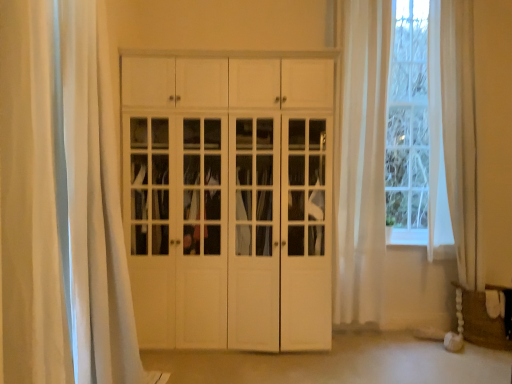
Question: Is sheer white curtain at right, the second curtain when ordered from left to right, wider or thinner than white matte cabinet at center?

Choices:
 (A) wide
 (B) thin

Answer: (B)

Question: From the image's perspective, is sheer white curtain at right, which appears as the first curtain when viewed from the back, above or below white matte cabinet at center?

Choices:
 (A) above
 (B) below

Answer: (A)

Question: Which object is positioned closest to the brown woven basket at lower right?

Choices:
 (A) white sheer curtain at left, marked as the 1th curtain in a front-to-back arrangement
 (B) sheer white curtain at right, the second curtain when ordered from left to right
 (C) white matte cabinet at center

Answer: (B)

Question: Which of these objects is positioned farthest from the brown woven basket at lower right?

Choices:
 (A) white sheer curtain at left, the 1th curtain positioned from the left
 (B) sheer white curtain at right, which ranks as the first curtain in right-to-left order
 (C) white matte cabinet at center

Answer: (A)